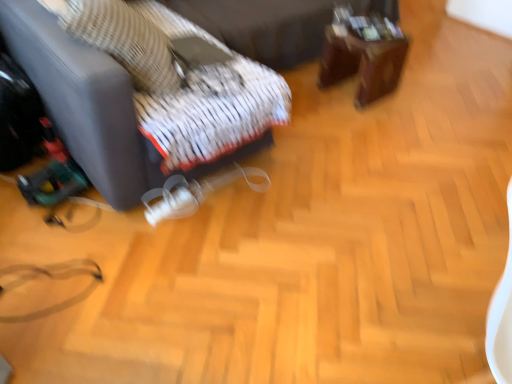
The image size is (512, 384). What are the coordinates of `empty space that is to the right of matte black suitcase at lower left` in the screenshot? It's located at (384, 192).